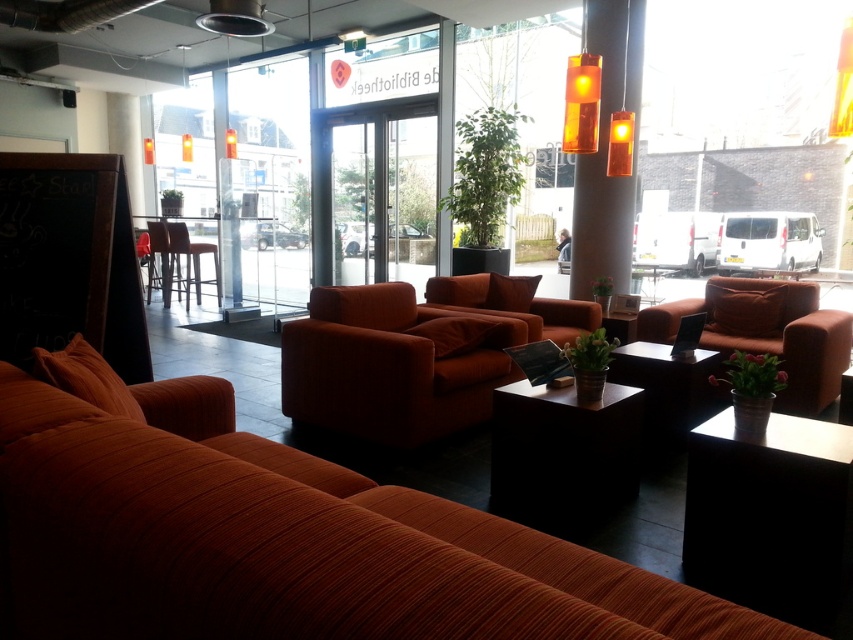
Question: Does black matte table at lower right have a smaller size compared to brown leather bar stool at center?

Choices:
 (A) no
 (B) yes

Answer: (B)

Question: Where is black matte table at lower right located in relation to matte orange armchair at center in the image?

Choices:
 (A) above
 (B) below

Answer: (B)

Question: Which is nearer to the matte red barstool at left?

Choices:
 (A) black matte table at lower right
 (B) brown leather bar stool at center
 (C) black matte table at center

Answer: (B)

Question: Which of the following is the closest to the observer?

Choices:
 (A) 370,220
 (B) 140,394
 (C) 196,304

Answer: (B)

Question: Does black matte table at lower right appear over transparent glass door at center?

Choices:
 (A) yes
 (B) no

Answer: (B)

Question: Which point is farther from the camera taking this photo?

Choices:
 (A) (192, 275)
 (B) (316, 147)
 (C) (170, 224)

Answer: (A)